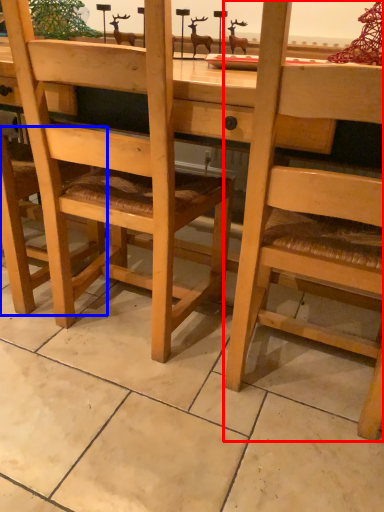
Question: Which object is further to the camera taking this photo, chair (highlighted by a red box) or chair (highlighted by a blue box)?

Choices:
 (A) chair
 (B) chair

Answer: (B)